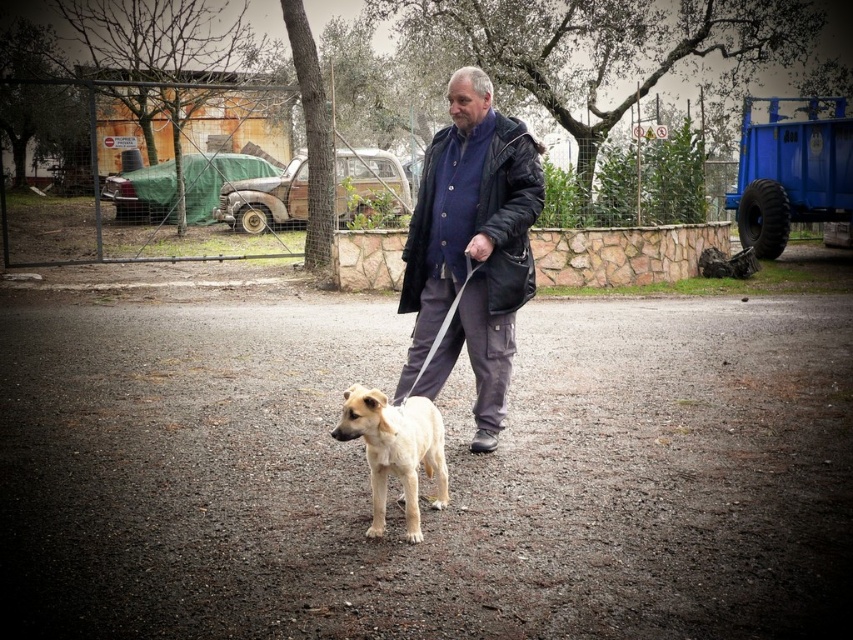
Question: Is dark blue jacket at center to the left of light brown fur dog at center from the viewer's perspective?

Choices:
 (A) yes
 (B) no

Answer: (B)

Question: Which point appears closest to the camera in this image?

Choices:
 (A) (407, 484)
 (B) (479, 120)

Answer: (A)

Question: Is dark blue jacket at center further to the viewer compared to light brown fur dog at center?

Choices:
 (A) yes
 (B) no

Answer: (A)

Question: Is dark blue jacket at center below light brown fur dog at center?

Choices:
 (A) yes
 (B) no

Answer: (B)